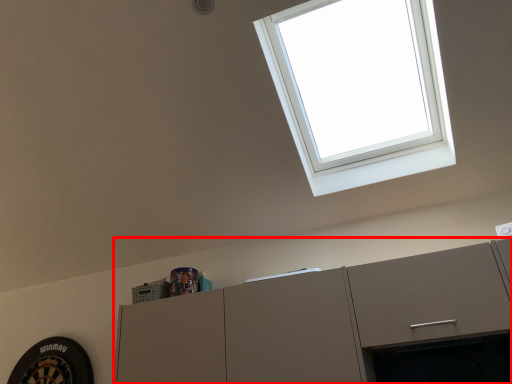
Question: From the image's perspective, considering the relative positions of cabinetry (annotated by the red box) and window in the image provided, where is cabinetry (annotated by the red box) located with respect to the staircase?

Choices:
 (A) below
 (B) above

Answer: (A)